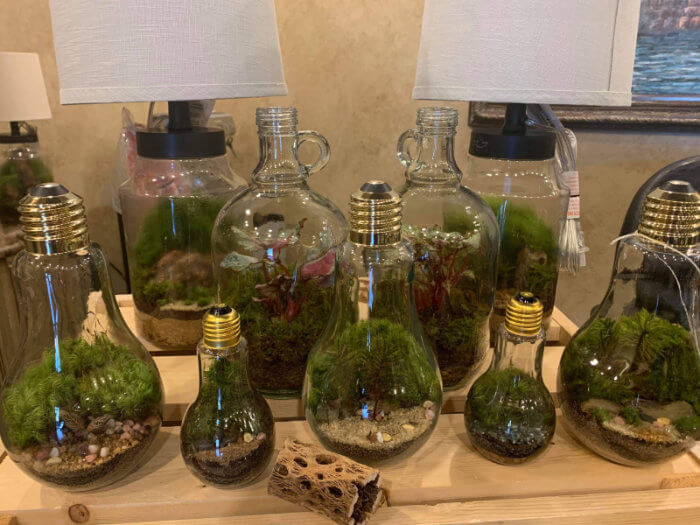
This screenshot has width=700, height=525. What are the coordinates of `cord` in the screenshot? It's located at (570, 251), (117, 270), (148, 108).